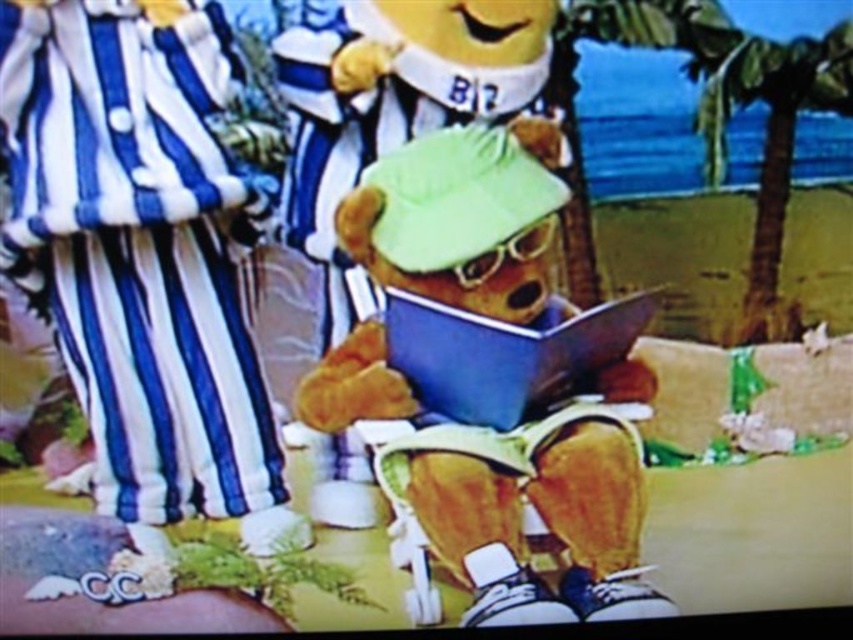
Is green leafy palm tree at upper right below blue matte book at center?

Incorrect, green leafy palm tree at upper right is not positioned below blue matte book at center.

Is green leafy palm tree at upper right bigger than blue matte book at center?

Indeed, green leafy palm tree at upper right has a larger size compared to blue matte book at center.

I want to click on green leafy palm tree at upper right, so click(x=738, y=106).

Which is above, fluffy brown teddy bear at center or green leafy palm tree at upper right?

green leafy palm tree at upper right is above.

Which is in front, point (432, 144) or point (782, 177)?

Point (432, 144) is in front.

Who is more forward, (425, 193) or (766, 140)?

Point (425, 193) is more forward.

Locate an element on the screen. fluffy brown teddy bear at center is located at coordinates (544, 522).

Who is positioned more to the right, fluffy brown teddy bear at center or blue matte book at center?

blue matte book at center is more to the right.

Which is in front, point (543, 202) or point (444, 321)?

Point (543, 202) is more forward.

Between point (601, 563) and point (521, 337), which one is positioned behind?

Point (601, 563)

The height and width of the screenshot is (640, 853). Find the location of `fluffy brown teddy bear at center`. fluffy brown teddy bear at center is located at coordinates (544, 522).